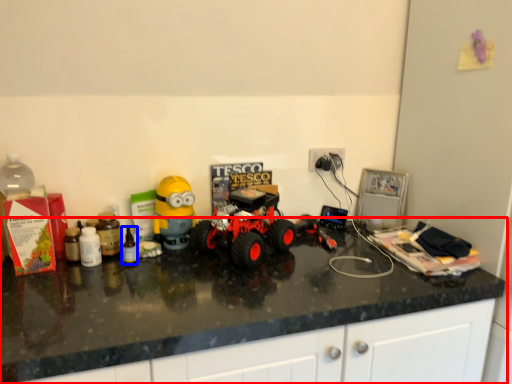
Question: Which point is closer to the camera, countertop (highlighted by a red box) or bottle (highlighted by a blue box)?

Choices:
 (A) countertop
 (B) bottle

Answer: (A)